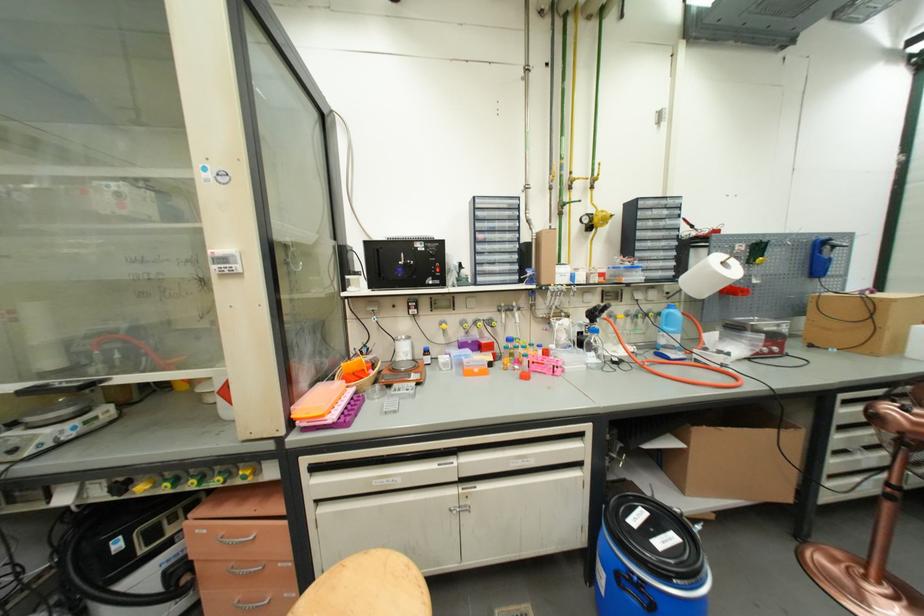
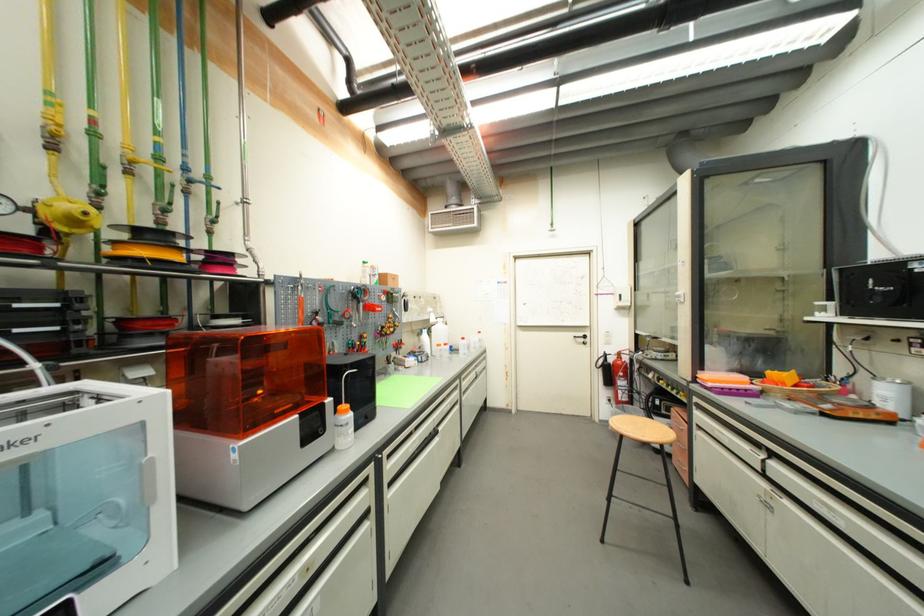
In the second image, find the point that corresponds to [457,464] in the first image.

(764, 456)